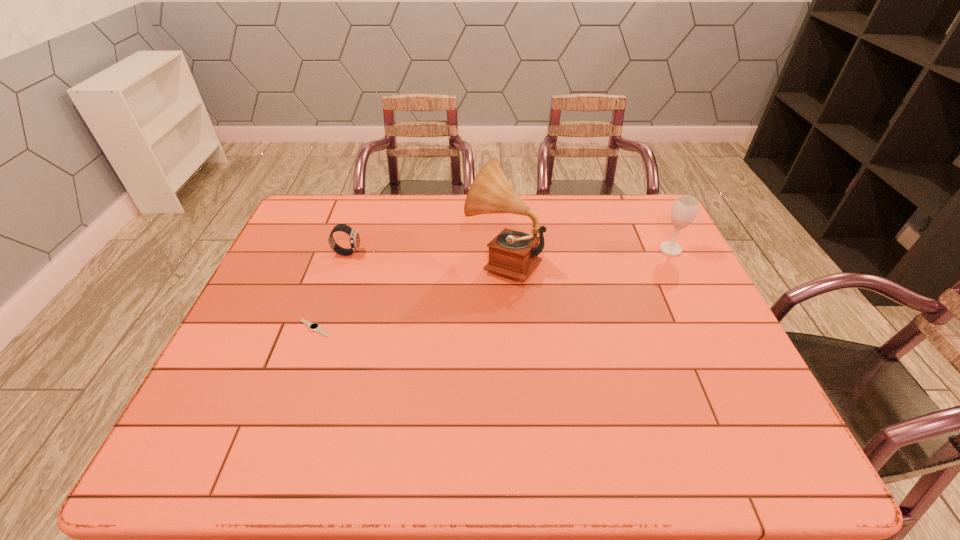
This screenshot has width=960, height=540. I want to click on empty space that is in between the tallest object and the shorter watch, so click(x=409, y=294).

Where is `empty space between the shorter watch and the second shortest object`? The height and width of the screenshot is (540, 960). empty space between the shorter watch and the second shortest object is located at coordinates (331, 290).

Where is `free spot between the rightmost object and the phonograph record`? This screenshot has height=540, width=960. free spot between the rightmost object and the phonograph record is located at coordinates (587, 255).

Where is `object that is the second nearest to the third shortest object`? object that is the second nearest to the third shortest object is located at coordinates (354, 241).

Point out which object is positioned as the third nearest to the second shortest object. Please provide its 2D coordinates. Your answer should be formatted as a tuple, i.e. [(x, y)], where the tuple contains the x and y coordinates of a point satisfying the conditions above.

[(685, 208)]

In order to click on vacant space that satisfies the following two spatial constraints: 1. on the front side of the rightmost object; 2. on the horn of the second object from right to left in this screenshot , I will do `click(675, 260)`.